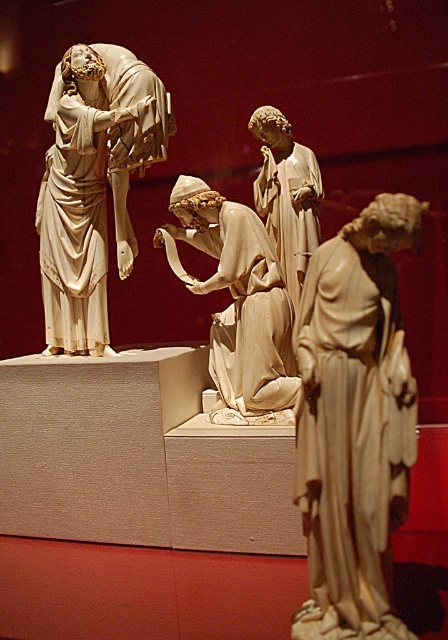
You are an art curator planning to install a spotlight on the white marble statue at left. The spotlight has a beam width of 0.5 meters. Given the statue is located at coordinates 0.292, 0.208, will the spotlight cover the entire statue?

The white marble statue at left is located at coordinates (93, 186). Since the spotlight has a beam width of 0.5 meters, it will cover the entire statue as the beam width is sufficient to encompass the statue at that location.

In the scene shown: You are an art conservator examining the sculptures from the front. You notice two points marked on the sculptures. The first point is at coordinate point (104, 90) and the second is at point (305, 209). Which point is closer to your viewpoint?

Point (104, 90) is closer to the camera than point (305, 209).